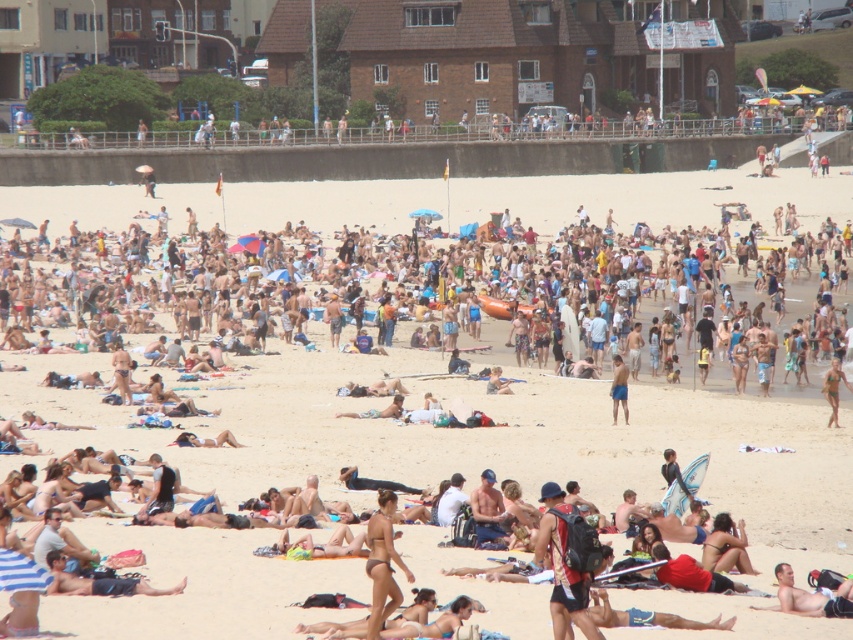
Question: Which point is farther to the camera?

Choices:
 (A) beige sand crowd at center
 (B) tan skin person at lower left

Answer: (A)

Question: Which of the following is the closest to the observer?

Choices:
 (A) tan skin man at center
 (B) tan skin person at lower left

Answer: (B)

Question: Does matte black bikini at center have a lesser width compared to tan skin man at center?

Choices:
 (A) no
 (B) yes

Answer: (B)

Question: Does tan skin person at lower left appear on the left side of tan skin man at center?

Choices:
 (A) yes
 (B) no

Answer: (A)

Question: Considering the real-world distances, which object is farthest from the red fabric swimsuit at center?

Choices:
 (A) beige sand crowd at center
 (B) tan skin person at lower left
 (C) tan skin man at center

Answer: (A)

Question: Can you confirm if red fabric swimsuit at center is wider than matte black bikini at center?

Choices:
 (A) yes
 (B) no

Answer: (B)